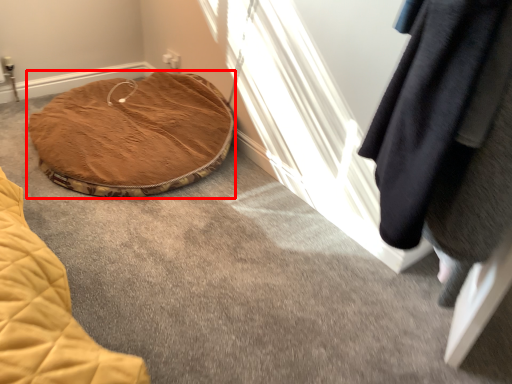
Question: Observing the image, what is the correct spatial positioning of furniture (annotated by the red box) in reference to clothing?

Choices:
 (A) right
 (B) left

Answer: (B)